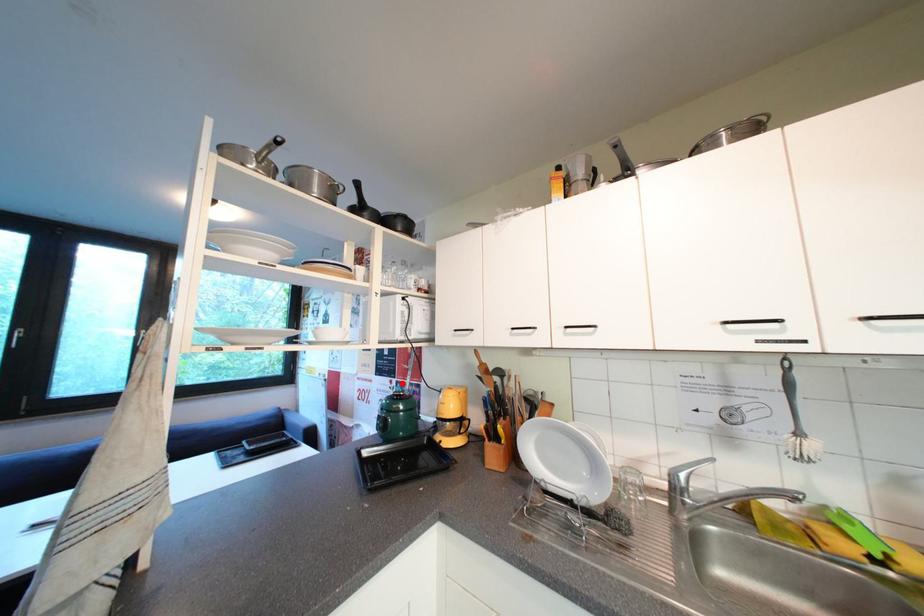
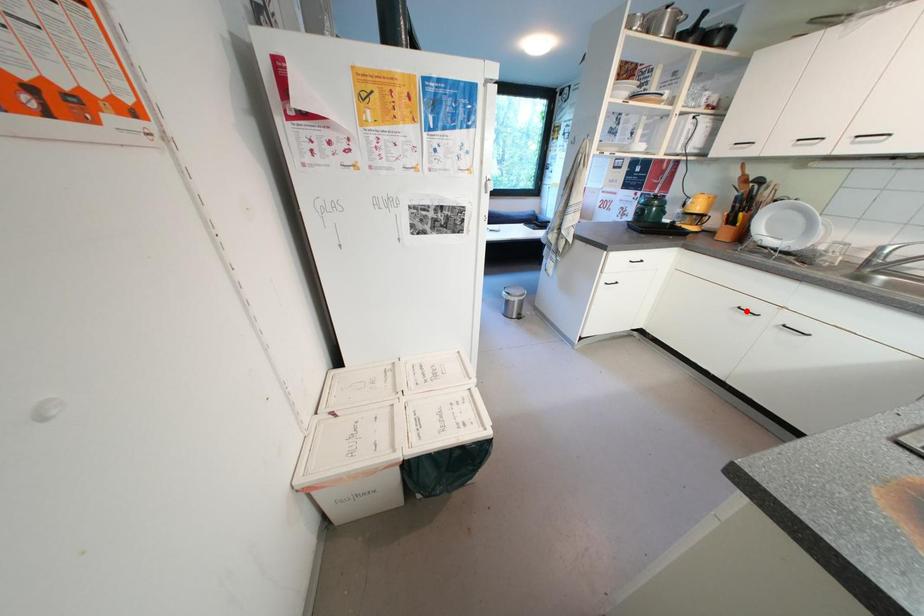
I am providing you with two images of the same scene from different viewpoints. A red point is marked on the first image and another point is marked on the second image. Is the marked point in image1 the same physical position as the marked point in image2?

No